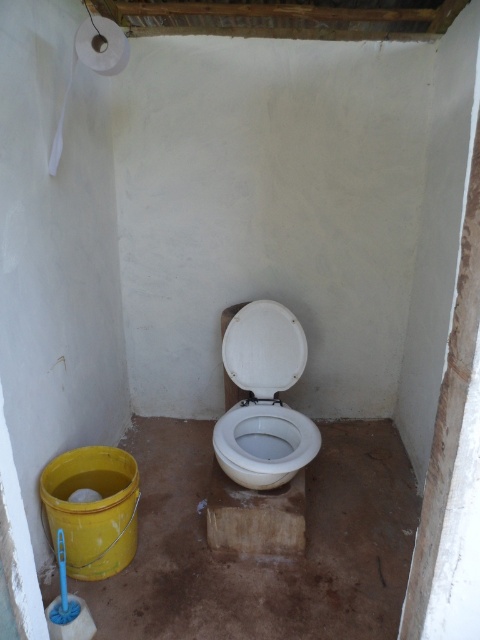
You are standing in the toilet area and want to reach both points mentioned. Which point, point (276, 406) or point (98, 49), will you need to stretch your arm further to touch?

You will need to stretch your arm further to touch point (98, 49) because it is closer to you than point (276, 406), which is further away.

You are a maintenance worker inspecting a toilet area. You need to check both the white glossy toilet bowl at center and the white matte toilet paper at upper left. Which object should you check first if you want to start from the left side of the area?

You should check the white matte toilet paper at upper left first because it is located to the left of the white glossy toilet bowl at center.